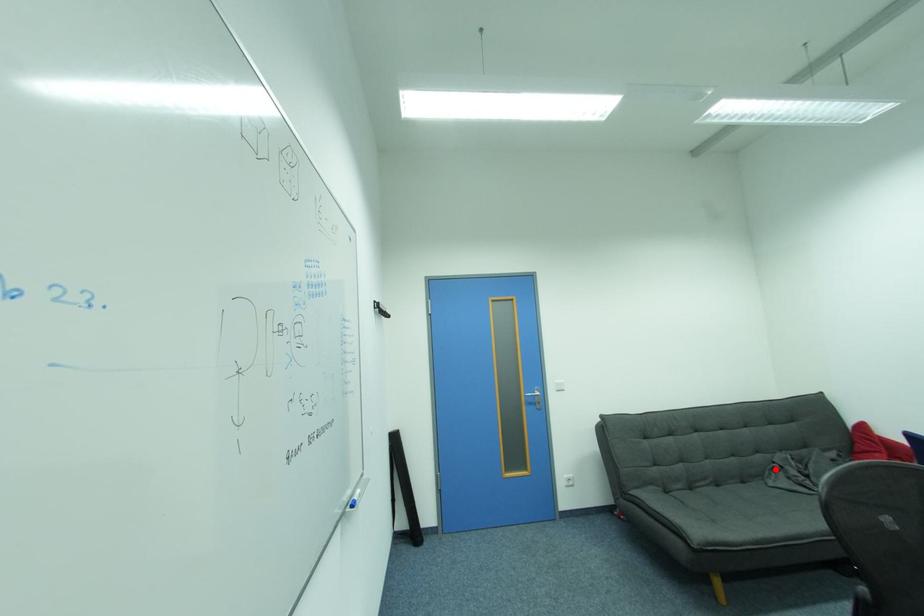
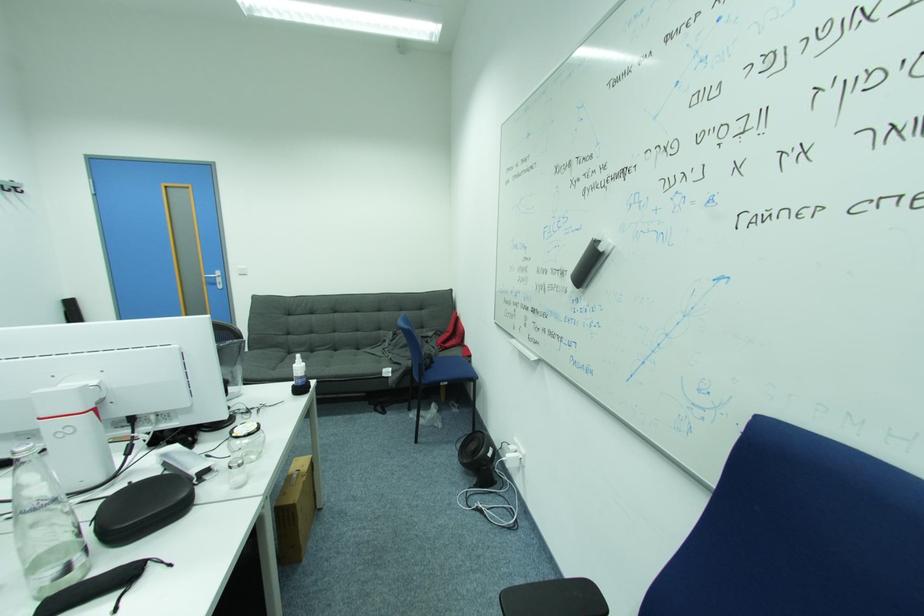
Question: I am providing you with two images of the same scene from different viewpoints. Given a red point in image1, look at the same physical point in image2. Is it:

Choices:
 (A) Closer to the viewpoint
 (B) Farther from the viewpoint

Answer: (B)